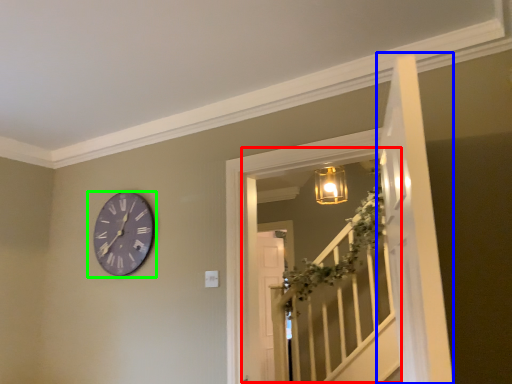
Question: Considering the real-world distances, which object is closest to window (highlighted by a red box)? door (highlighted by a blue box) or wall clock (highlighted by a green box).

Choices:
 (A) door
 (B) wall clock

Answer: (B)